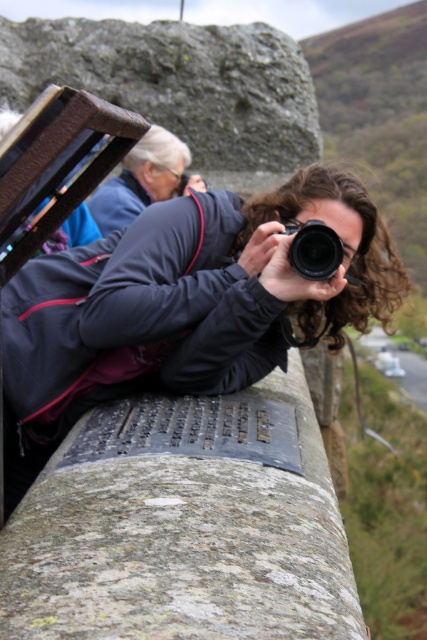
You are planning to install a new bench between the two jackets. The bench will be 6 feet long. Is there enough space between the matte black jacket at center and the matte blue jacket at upper left to place the bench without moving either jacket?

The distance between the matte black jacket at center and the matte blue jacket at upper left is 12.74 feet. Since the bench is 6 feet long, there is sufficient space to place the bench between them without moving either jacket.

You are a photographer trying to capture the scene of the person taking a photo. You notice the matte black jacket at center and the black plastic camera at center. Which object is positioned to the right side of the other?

The black plastic camera at center is positioned to the right of the matte black jacket at center, as the matte black jacket at center is to the left of the black plastic camera at center.